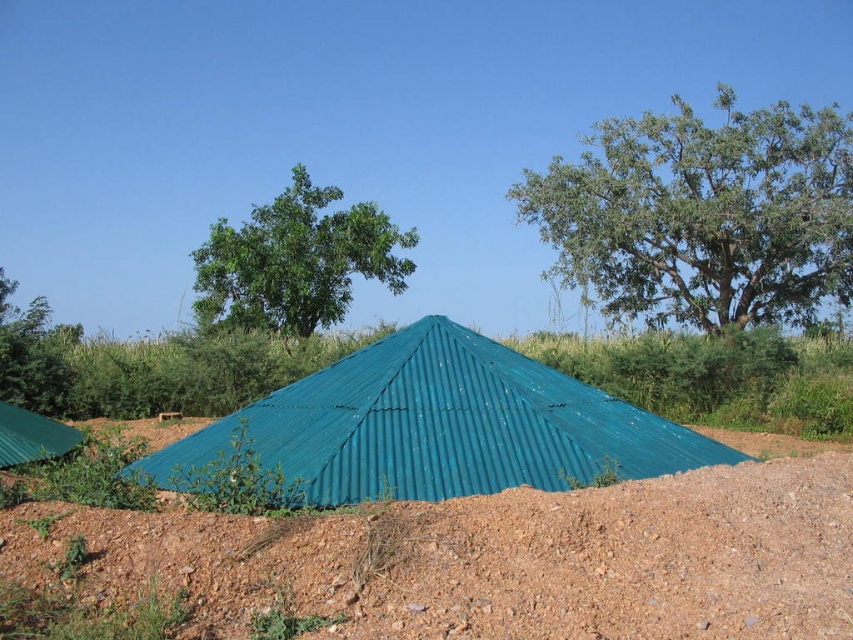
You are standing at the point marked by the coordinates point (508,556) in this rural scene. What type of terrain are you currently standing on?

You are standing on brown gravelly dirt at center, which is represented by the point (508,556).

You are standing in the rural area looking at the scene. You want to walk towards the green leafy tree at upper right and the green leafy tree at left. Which tree should you approach first to reach the one closer to you?

You should approach the green leafy tree at upper right first because it is closer to you than the green leafy tree at left.